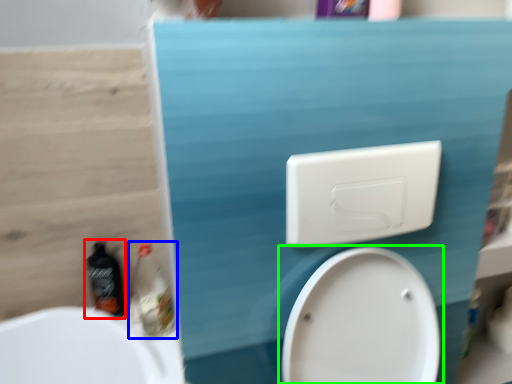
Question: Based on their relative distances, which object is farther from bottle (highlighted by a red box)? Choose from cleaning product (highlighted by a blue box) and toilet (highlighted by a green box).

Choices:
 (A) cleaning product
 (B) toilet

Answer: (B)